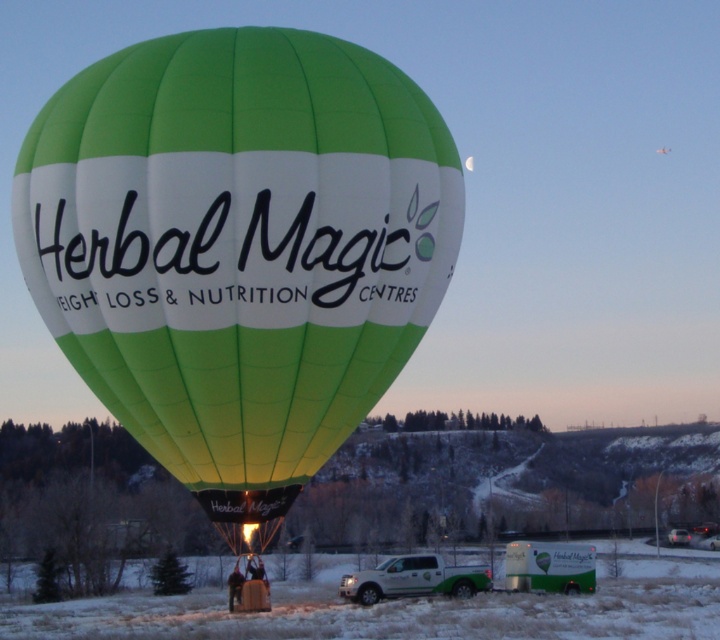
You are standing in front of the green fabric hot air balloon at center and the green fabric balloon at center. Which one is closer to you?

The green fabric hot air balloon at center is closer to you than the green fabric balloon at center.

What are the coordinates of the green fabric hot air balloon at center?

The green fabric hot air balloon at center is located at coordinates point (238, 246).

You are a photographer positioned at the base of the green fabric hot air balloon at center and the green fabric balloon at center. You want to capture a photo that includes both objects in the frame. Which object should you focus on first to ensure both are in the shot?

The green fabric hot air balloon at center is below the green fabric balloon at center, so you should focus on the lower one first to ensure both are in the shot.